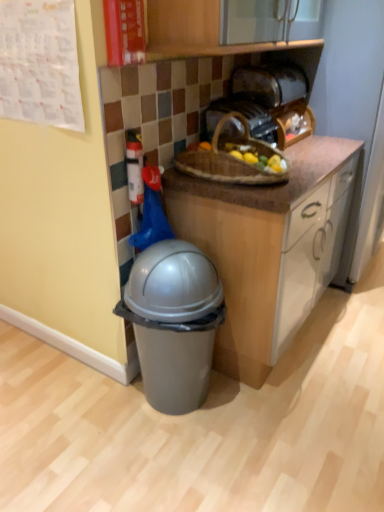
What are the coordinates of `vacant space underneath gray plastic trash can at lower left (from a real-world perspective)` in the screenshot? It's located at (183, 413).